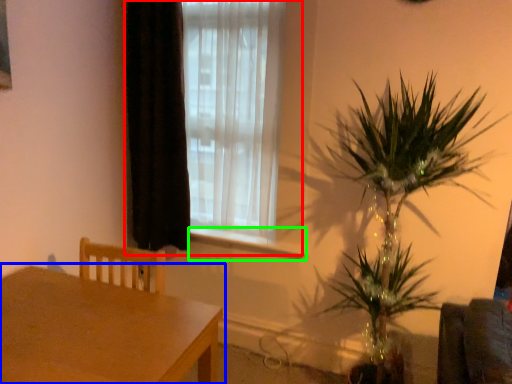
Question: Which is farther away from window (highlighted by a red box)? table (highlighted by a blue box) or window sill (highlighted by a green box)?

Choices:
 (A) table
 (B) window sill

Answer: (A)